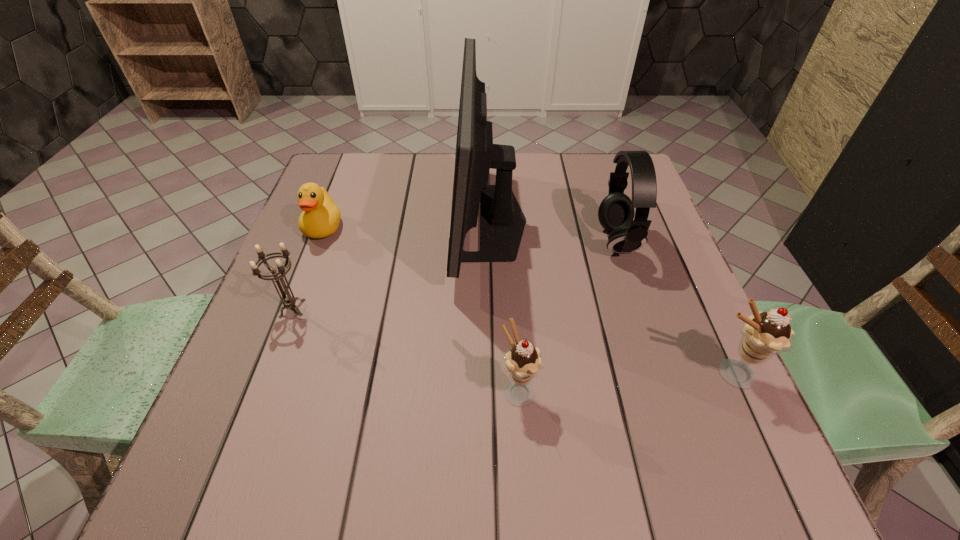
Find the location of `vacant position in the image that satisfies the following two spatial constraints: 1. on the screen side of the tallest object; 2. on the right side of the taller icecream`. vacant position in the image that satisfies the following two spatial constraints: 1. on the screen side of the tallest object; 2. on the right side of the taller icecream is located at coordinates (492, 374).

Where is `vacant position in the image that satisfies the following two spatial constraints: 1. on the ear cups of the earphone; 2. on the front side of the shorter icecream`? The height and width of the screenshot is (540, 960). vacant position in the image that satisfies the following two spatial constraints: 1. on the ear cups of the earphone; 2. on the front side of the shorter icecream is located at coordinates (665, 390).

The width and height of the screenshot is (960, 540). I want to click on vacant space that satisfies the following two spatial constraints: 1. on the screen side of the rightmost object; 2. on the right side of the tallest object, so click(x=492, y=374).